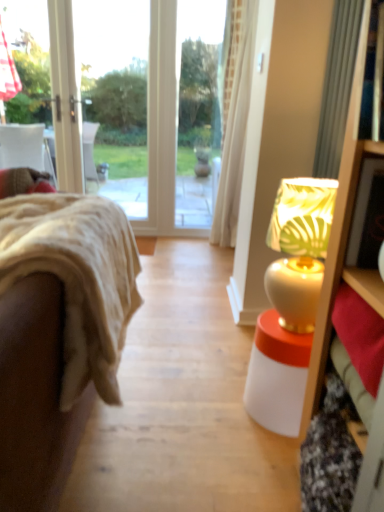
Question: Does white glossy table lamp at right have a greater height compared to velvet beige couch at left?

Choices:
 (A) no
 (B) yes

Answer: (B)

Question: Is white glossy table lamp at right bigger than velvet beige couch at left?

Choices:
 (A) yes
 (B) no

Answer: (B)

Question: Is the position of white glossy table lamp at right more distant than that of velvet beige couch at left?

Choices:
 (A) yes
 (B) no

Answer: (A)

Question: From the image's perspective, does white glossy table lamp at right appear higher than velvet beige couch at left?

Choices:
 (A) yes
 (B) no

Answer: (A)

Question: Is white glossy table lamp at right next to velvet beige couch at left and touching it?

Choices:
 (A) no
 (B) yes

Answer: (A)

Question: From a real-world perspective, does white glossy table lamp at right stand above velvet beige couch at left?

Choices:
 (A) no
 (B) yes

Answer: (B)

Question: Considering the relative sizes of velvet beige couch at left and white glossy table lamp at right in the image provided, is velvet beige couch at left taller than white glossy table lamp at right?

Choices:
 (A) no
 (B) yes

Answer: (A)

Question: Is velvet beige couch at left further to camera compared to white glossy table lamp at right?

Choices:
 (A) yes
 (B) no

Answer: (B)

Question: From a real-world perspective, is velvet beige couch at left located beneath white glossy table lamp at right?

Choices:
 (A) yes
 (B) no

Answer: (A)

Question: From the image's perspective, is velvet beige couch at left under white glossy table lamp at right?

Choices:
 (A) yes
 (B) no

Answer: (A)

Question: From a real-world perspective, is velvet beige couch at left positioned over white glossy table lamp at right based on gravity?

Choices:
 (A) no
 (B) yes

Answer: (A)

Question: Can you confirm if velvet beige couch at left is positioned to the right of white glossy table lamp at right?

Choices:
 (A) no
 (B) yes

Answer: (A)

Question: In the image, is white glossy table lamp at right on the left side or the right side of velvet beige couch at left?

Choices:
 (A) left
 (B) right

Answer: (B)